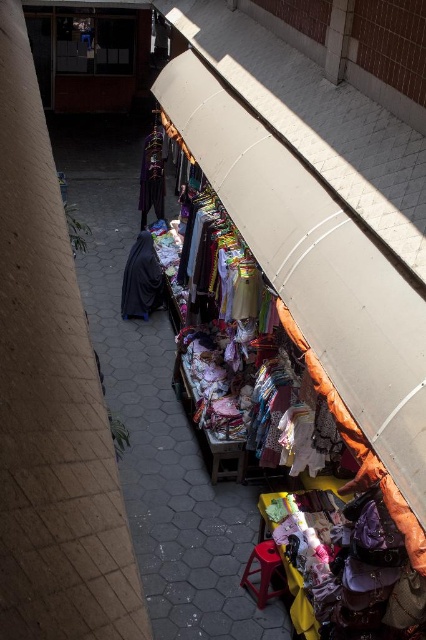
You are a customer at the market stall and want to pick up both the black matte fabric at center and the velvet purple dress at center. If your arms can extend 3 feet, can you reach both items without moving?

The distance between the black matte fabric at center and the velvet purple dress at center is 8.47 feet, which is greater than your arm span of 3 feet. Therefore, you cannot reach both items without moving.

You are a customer at the market stall and want to find the black matte fabric at center. Based on the overhead view, can you estimate its position relative to the center of the stall?

The black matte fabric at center is located at coordinates approximately 0.438 on the x axis and 0.333 on the y axis, which means it is slightly to the right and slightly below the exact center of the stall.